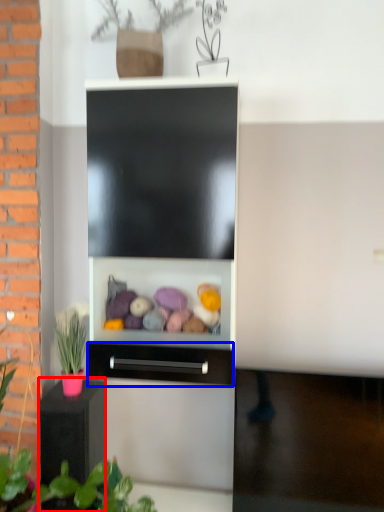
Question: Which point is further to the camera, furniture (highlighted by a red box) or drawer (highlighted by a blue box)?

Choices:
 (A) furniture
 (B) drawer

Answer: (A)